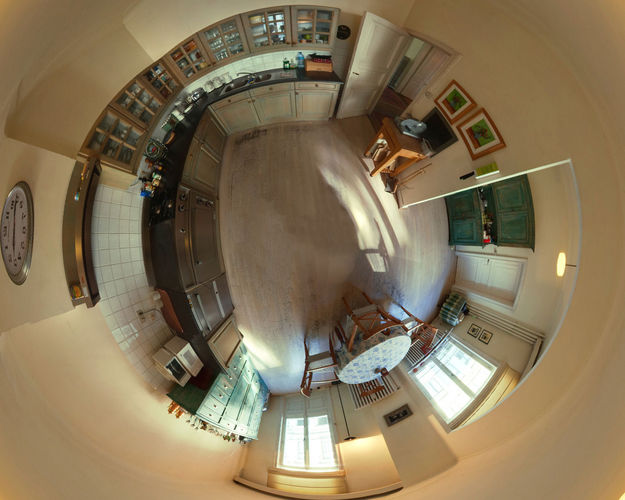
Where is `faucet`? faucet is located at coordinates (242, 73).